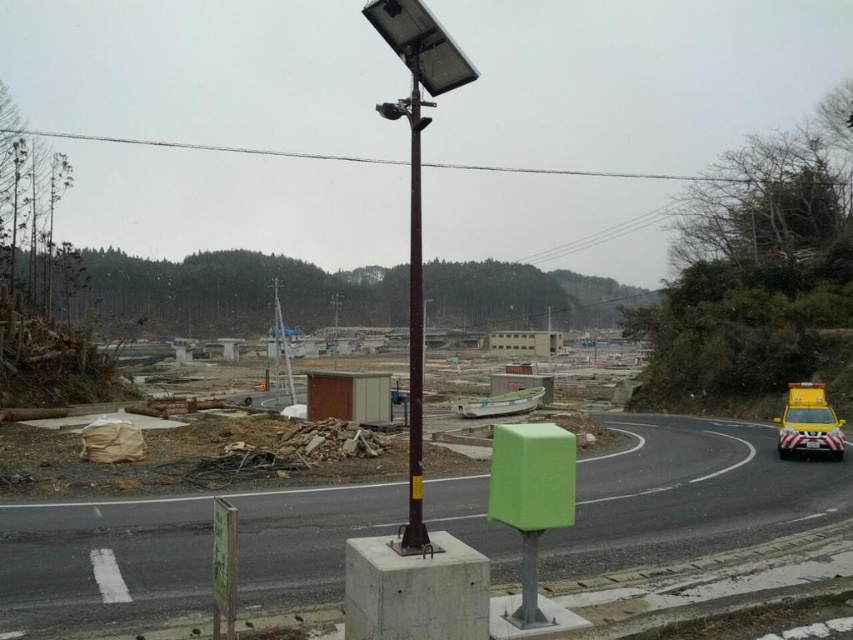
Question: Which of the following is the closest to the observer?

Choices:
 (A) (99, 529)
 (B) (421, 506)

Answer: (B)

Question: Does green plastic box at center appear on the right side of yellow matte van at right?

Choices:
 (A) yes
 (B) no

Answer: (B)

Question: Among these objects, which one is farthest from the camera?

Choices:
 (A) brown metallic pole at center
 (B) green plastic box at center
 (C) yellow matte van at right

Answer: (C)

Question: Which point is farther to the camera?

Choices:
 (A) yellow matte van at right
 (B) green plastic box at center
 (C) brown metallic pole at center

Answer: (A)

Question: Does green plastic box at center appear on the right side of brown metallic pole at center?

Choices:
 (A) no
 (B) yes

Answer: (B)

Question: Can you confirm if green plastic box at center is positioned above brown metallic pole at center?

Choices:
 (A) yes
 (B) no

Answer: (B)